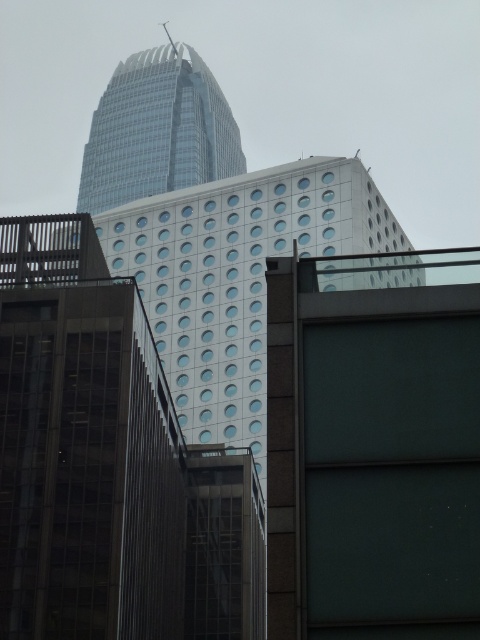
Question: Can you confirm if glassy reflective building at center is positioned to the left of white textured building at center?

Choices:
 (A) no
 (B) yes

Answer: (B)

Question: Which point is closer to the camera?

Choices:
 (A) (339, 531)
 (B) (358, 232)
 (C) (8, 326)
 (D) (132, 193)

Answer: (A)

Question: Can you confirm if glassy reflective building at center is thinner than white textured building at center?

Choices:
 (A) yes
 (B) no

Answer: (A)

Question: Which point is farther to the camera?

Choices:
 (A) 178,115
 (B) 412,264
 (C) 314,200

Answer: (A)

Question: Where is dark glass building at upper center located in relation to transparent glass skyscraper at upper center in the image?

Choices:
 (A) above
 (B) below

Answer: (B)

Question: Estimate the real-world distances between objects in this image. Which object is farther from the glassy reflective building at center?

Choices:
 (A) dark glass building at upper center
 (B) transparent glass skyscraper at upper center

Answer: (B)